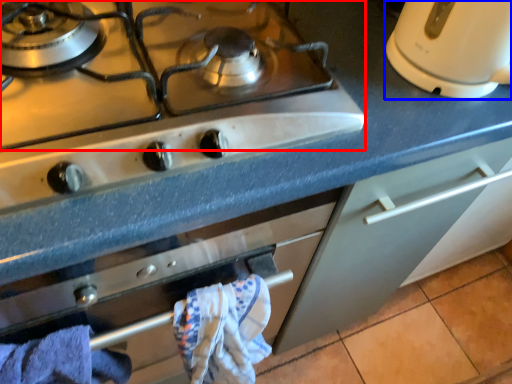
Question: Which point is closer to the camera, gas stove (highlighted by a red box) or kitchen appliance (highlighted by a blue box)?

Choices:
 (A) gas stove
 (B) kitchen appliance

Answer: (A)